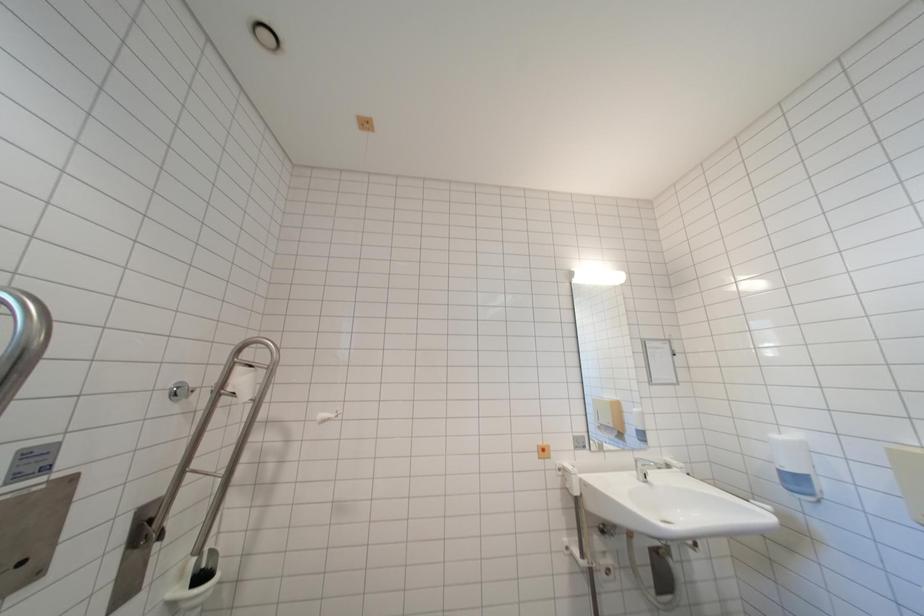
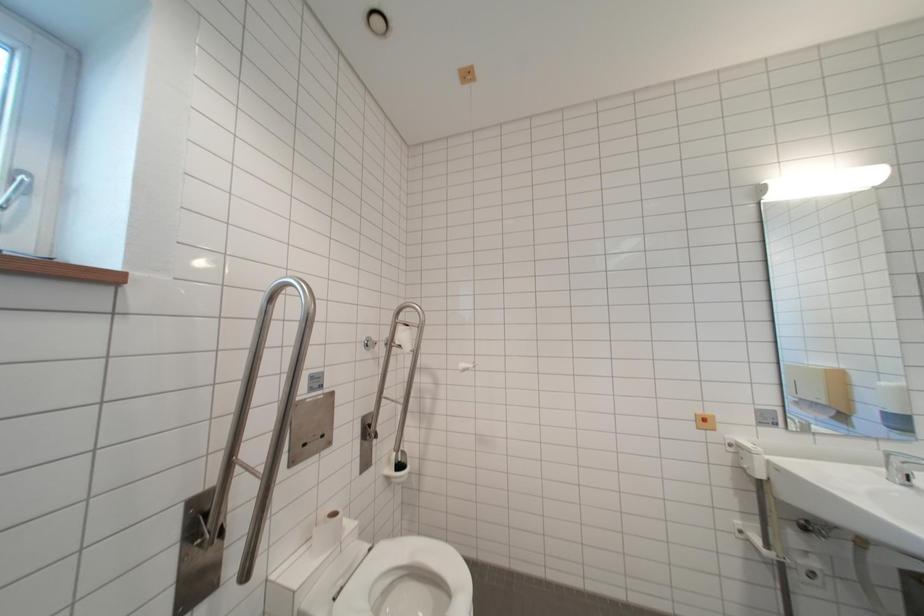
Question: The camera is either moving clockwise (left) or counter-clockwise (right) around the object. The first image is from the beginning of the video and the second image is from the end. Is the camera moving left or right when shooting the video?

Choices:
 (A) Left
 (B) Right

Answer: (B)